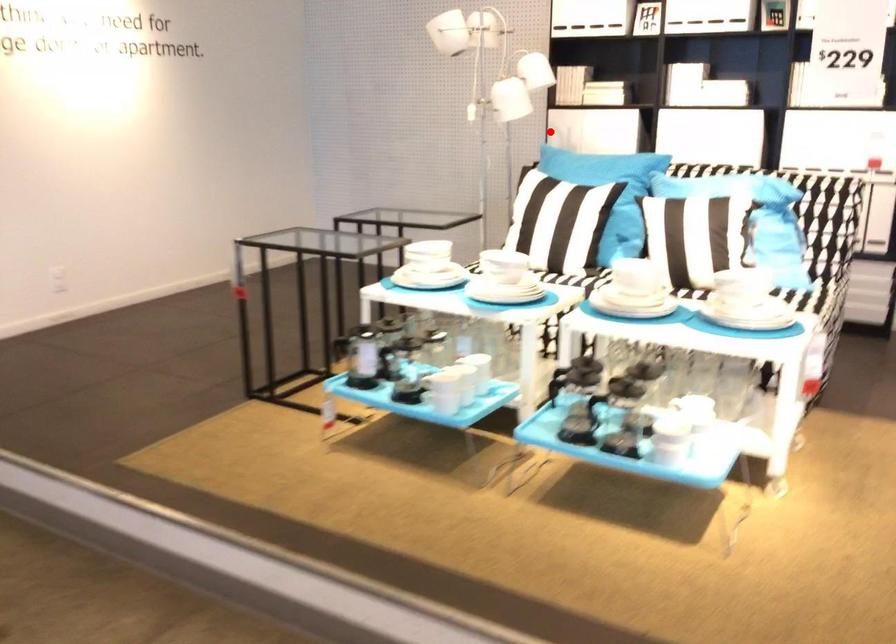
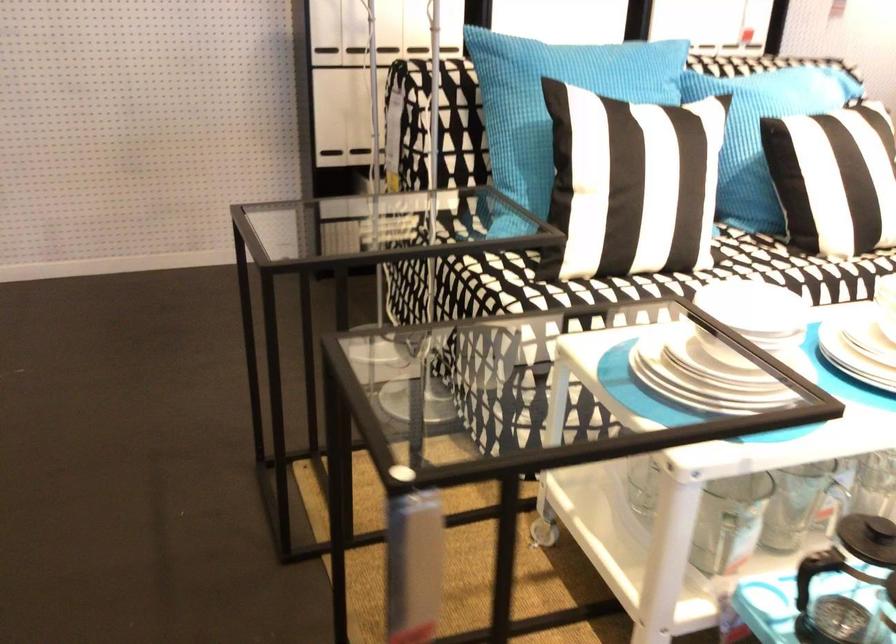
In the second image, find the point that corresponds to the highlighted location in the first image.

(325, 46)